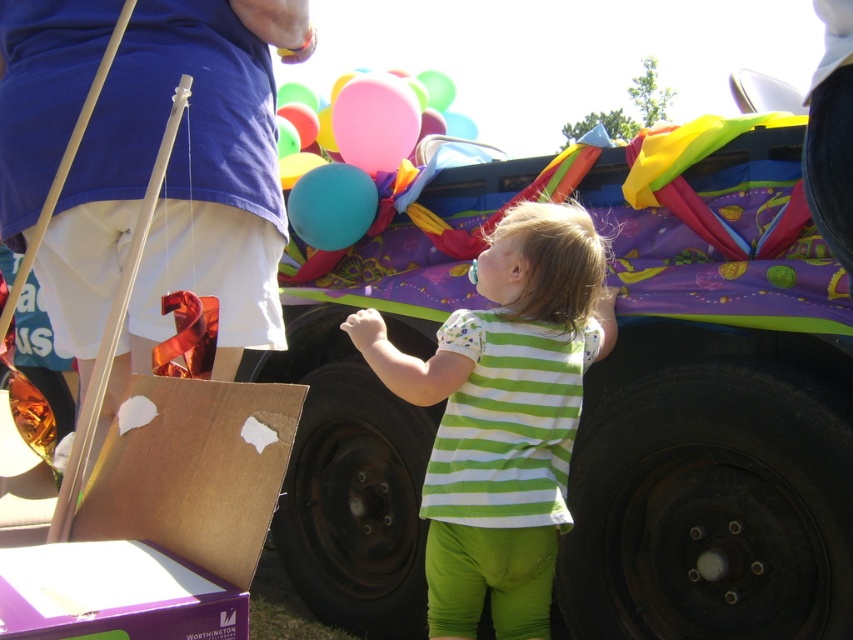
Which is behind, point (512, 228) or point (379, 125)?

The point (379, 125) is more distant.

Does green striped shirt at center lie in front of pink rubber balloon at upper center?

That is True.

Between point (503, 604) and point (352, 124), which one is positioned behind?

Positioned behind is point (352, 124).

Image resolution: width=853 pixels, height=640 pixels. Identify the location of green striped shirt at center. (503, 417).

Does brown cardboard box at lower left have a smaller size compared to matte blue balloon at upper center?

Yes.

Can you confirm if brown cardboard box at lower left is shorter than matte blue balloon at upper center?

Indeed, brown cardboard box at lower left has a lesser height compared to matte blue balloon at upper center.

Locate an element on the screen. brown cardboard box at lower left is located at coordinates (193, 470).

Between point (241, 451) and point (334, 170), which one is positioned in front?

Point (241, 451)

Between brown cardboard box at lower left and translucent blue balloon at center, which one has more height?

translucent blue balloon at center is taller.

Image resolution: width=853 pixels, height=640 pixels. Identify the location of brown cardboard box at lower left. (193, 470).